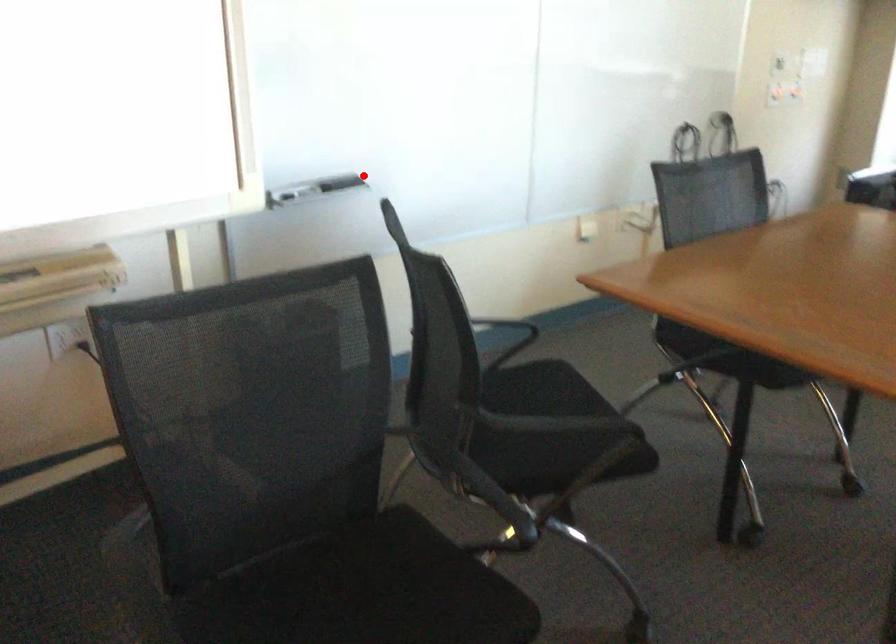
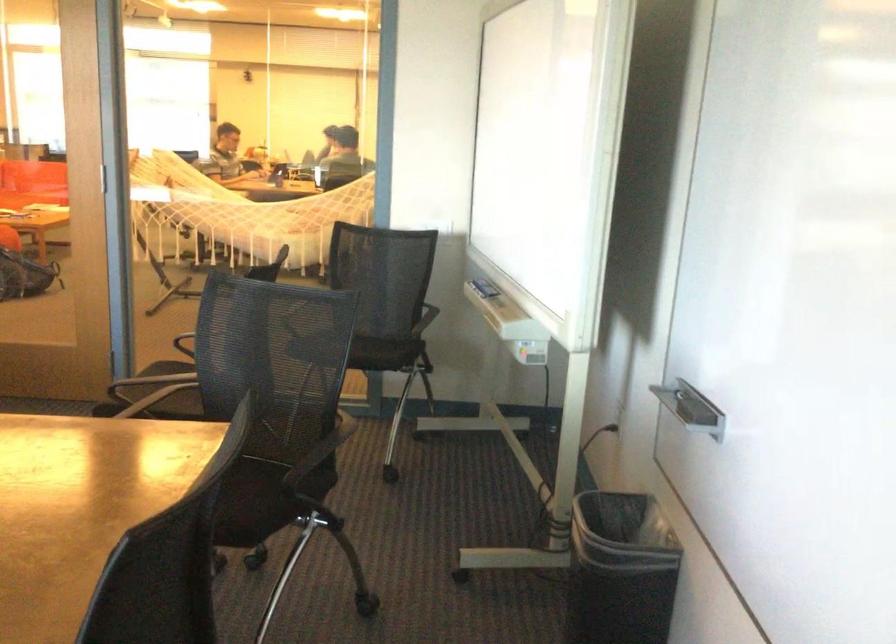
Question: I am providing you with two images of the same scene from different viewpoints. Given a red point in image1, look at the same physical point in image2. Is it:

Choices:
 (A) Closer to the viewpoint
 (B) Farther from the viewpoint

Answer: (A)